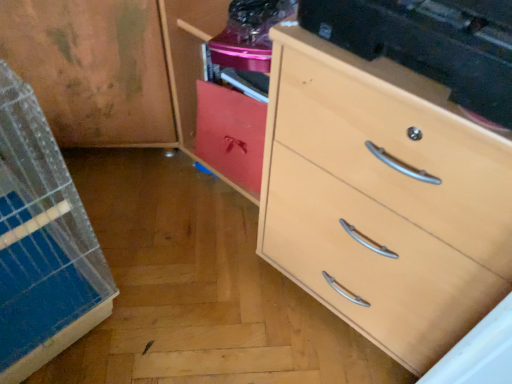
At what (x,y) coordinates should I click in order to perform the action: click on matte red cabinet at center. Please return your answer as a coordinate pair (x, y). Image resolution: width=512 pixels, height=384 pixels. Looking at the image, I should click on (231, 134).

This screenshot has width=512, height=384. Describe the element at coordinates (231, 134) in the screenshot. I see `matte red cabinet at center` at that location.

Where is `light wood chest of drawers at right`? The width and height of the screenshot is (512, 384). light wood chest of drawers at right is located at coordinates (383, 198).

What is the approximate height of light wood chest of drawers at right?

light wood chest of drawers at right is 24.77 inches in height.

The image size is (512, 384). What do you see at coordinates (383, 198) in the screenshot?
I see `light wood chest of drawers at right` at bounding box center [383, 198].

Locate an element on the screen. The height and width of the screenshot is (384, 512). matte red cabinet at center is located at coordinates (231, 134).

In the image, is light wood chest of drawers at right on the left side or the right side of matte red cabinet at center?

light wood chest of drawers at right is positioned on matte red cabinet at center's right side.

Is light wood chest of drawers at right in front of or behind matte red cabinet at center in the image?

In the image, light wood chest of drawers at right appears in front of matte red cabinet at center.

Is point (317, 217) less distant than point (245, 107)?

Yes, it is in front of point (245, 107).

From the image's perspective, which object appears higher, light wood chest of drawers at right or matte red cabinet at center?

matte red cabinet at center appears higher in the image.

From a real-world perspective, which is physically below, light wood chest of drawers at right or matte red cabinet at center?

In real-world perspective, matte red cabinet at center is lower.

Looking at this image, considering the relative sizes of light wood chest of drawers at right and matte red cabinet at center in the image provided, is light wood chest of drawers at right wider than matte red cabinet at center?

Yes, light wood chest of drawers at right is wider than matte red cabinet at center.

In terms of height, does light wood chest of drawers at right look taller or shorter compared to matte red cabinet at center?

light wood chest of drawers at right is taller than matte red cabinet at center.

Considering the sizes of objects light wood chest of drawers at right and matte red cabinet at center in the image provided, who is bigger, light wood chest of drawers at right or matte red cabinet at center?

light wood chest of drawers at right is bigger.

Is light wood chest of drawers at right positioned beyond the bounds of matte red cabinet at center?

Absolutely, light wood chest of drawers at right is external to matte red cabinet at center.

Are light wood chest of drawers at right and matte red cabinet at center making contact?

No.

Does light wood chest of drawers at right turn towards matte red cabinet at center?

No, light wood chest of drawers at right is not aimed at matte red cabinet at center.

What's the angular difference between light wood chest of drawers at right and matte red cabinet at center's facing directions?

light wood chest of drawers at right and matte red cabinet at center are facing 0.419 degrees away from each other.

Locate an element on the screen. The width and height of the screenshot is (512, 384). cabinetry behind the light wood chest of drawers at right is located at coordinates (231, 134).

Based on their positions, is matte red cabinet at center located to the left or right of light wood chest of drawers at right?

From the image, it's evident that matte red cabinet at center is to the left of light wood chest of drawers at right.

Which object is further away from the camera taking this photo, matte red cabinet at center or light wood chest of drawers at right?

matte red cabinet at center is more distant.

Which is closer, [259,172] or [380,229]?

Point [259,172] appears to be farther away from the viewer than point [380,229].

From the image's perspective, which object appears higher, matte red cabinet at center or light wood chest of drawers at right?

matte red cabinet at center, from the image's perspective.

From a real-world perspective, which object stands above the other?

From a 3D spatial view, light wood chest of drawers at right is above.

Is matte red cabinet at center wider or thinner than light wood chest of drawers at right?

matte red cabinet at center is thinner than light wood chest of drawers at right.

From the picture: From their relative heights in the image, would you say matte red cabinet at center is taller or shorter than light wood chest of drawers at right?

matte red cabinet at center is shorter than light wood chest of drawers at right.

Considering the relative sizes of matte red cabinet at center and light wood chest of drawers at right in the image provided, is matte red cabinet at center bigger than light wood chest of drawers at right?

Incorrect, matte red cabinet at center is not larger than light wood chest of drawers at right.

Is light wood chest of drawers at right surrounded by matte red cabinet at center?

No, light wood chest of drawers at right is not surrounded by matte red cabinet at center.

Are matte red cabinet at center and light wood chest of drawers at right making contact?

matte red cabinet at center and light wood chest of drawers at right are clearly separated.

Is matte red cabinet at center oriented away from light wood chest of drawers at right?

No.

Identify the location of cabinetry behind the light wood chest of drawers at right. (231, 134).

In order to click on cabinetry that appears behind the light wood chest of drawers at right in this screenshot , I will do `click(231, 134)`.

This screenshot has width=512, height=384. In order to click on chest of drawers above the matte red cabinet at center (from a real-world perspective) in this screenshot , I will do `click(383, 198)`.